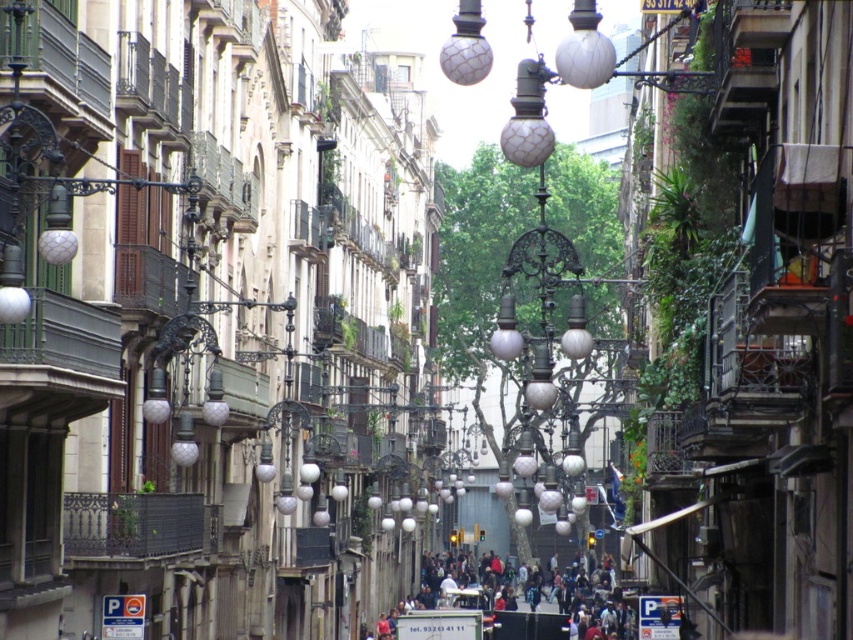
How much distance is there between matte glass lamp post at center and dark gray concrete crowd at center?

matte glass lamp post at center and dark gray concrete crowd at center are 16.74 meters apart.

Who is positioned more to the right, matte glass lamp post at center or dark gray concrete crowd at center?

From the viewer's perspective, matte glass lamp post at center appears more on the right side.

What are the coordinates of `matte glass lamp post at center` in the screenshot? It's located at (x=547, y=256).